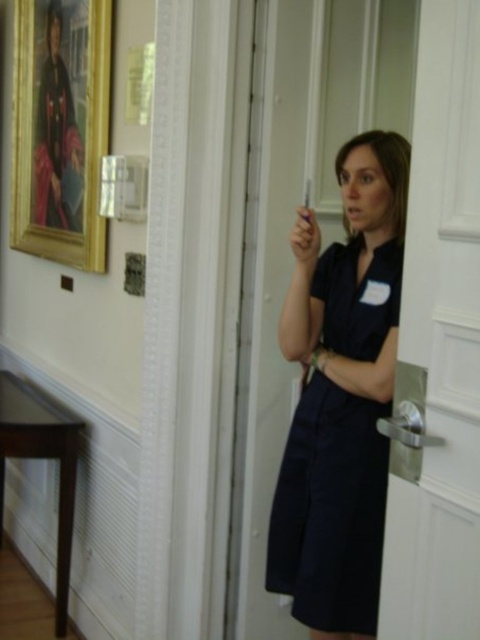
Between white glossy door at center and navy blue fabric dress at center, which one has less height?

navy blue fabric dress at center is shorter.

Is white glossy door at center further to camera compared to navy blue fabric dress at center?

No, it is not.

Which is in front, point (416, 605) or point (362, 310)?

Point (416, 605) is in front.

Identify the location of white glossy door at center. (439, 346).

Can you confirm if white glossy door at center is shorter than gold-framed portrait at upper left?

Yes, white glossy door at center is shorter than gold-framed portrait at upper left.

In the scene shown: Who is higher up, white glossy door at center or gold-framed portrait at upper left?

gold-framed portrait at upper left is higher up.

Does point (467, 596) lie in front of point (36, 252)?

Yes.

This screenshot has height=640, width=480. I want to click on white glossy door at center, so click(x=439, y=346).

Who is higher up, navy blue fabric dress at center or matte plastic cigarette at center?

matte plastic cigarette at center is above.

Which is below, navy blue fabric dress at center or matte plastic cigarette at center?

navy blue fabric dress at center

Does point (355, 342) come behind point (303, 216)?

That is False.

The height and width of the screenshot is (640, 480). What are the coordinates of `navy blue fabric dress at center` in the screenshot? It's located at tap(331, 509).